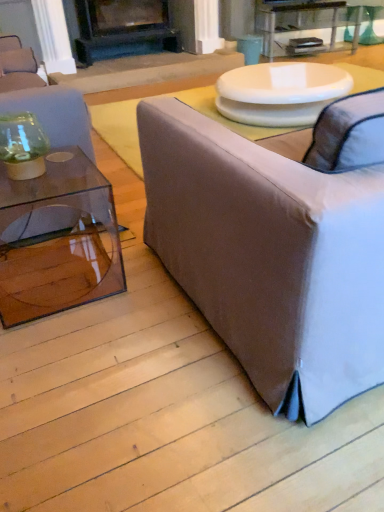
The width and height of the screenshot is (384, 512). Find the location of `free point above transparent glass coffee table at left (from a real-world perspective)`. free point above transparent glass coffee table at left (from a real-world perspective) is located at coordinates (47, 173).